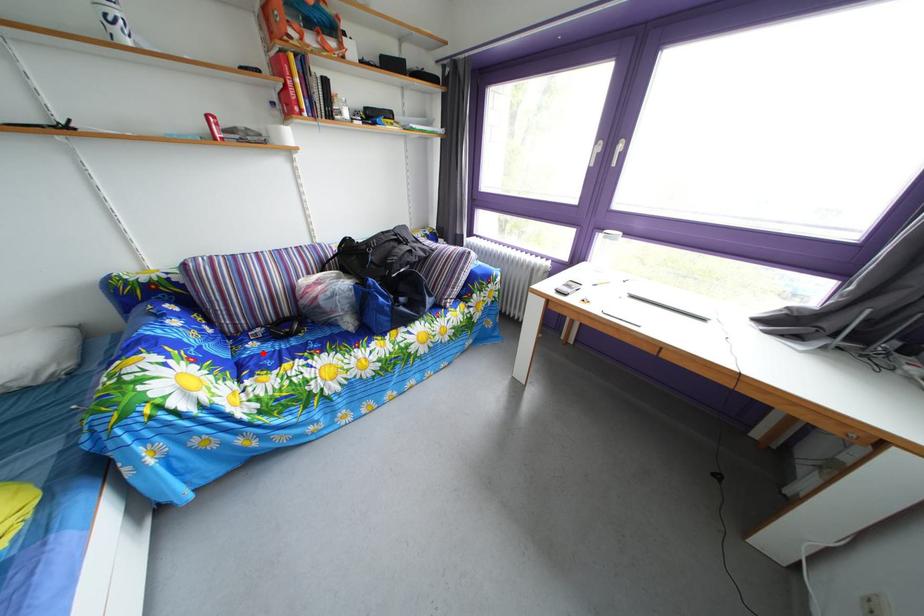
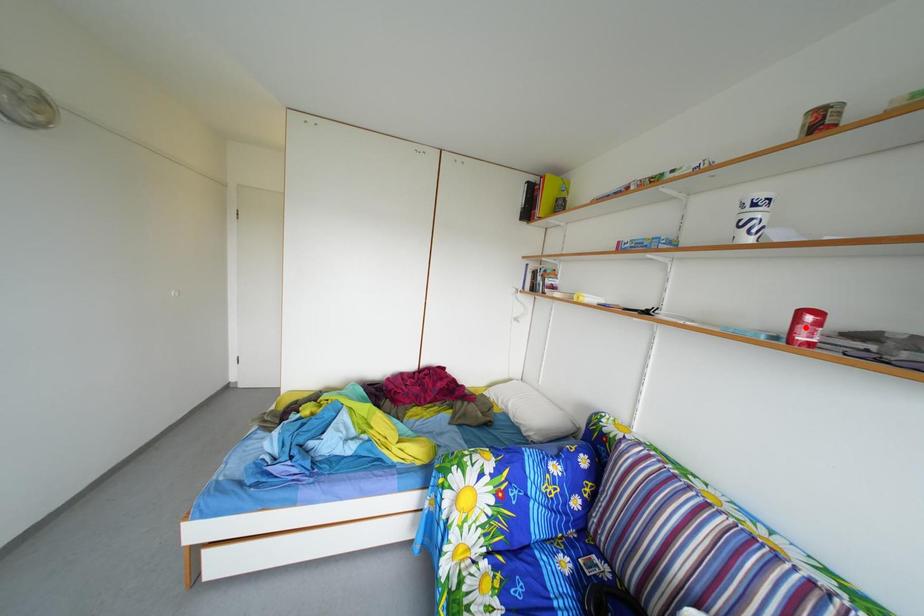
I am providing you with two images of the same scene from different viewpoints. A red point is marked on the first image and another point is marked on the second image. Do the highlighted points in image1 and image2 indicate the same real-world spot?

No